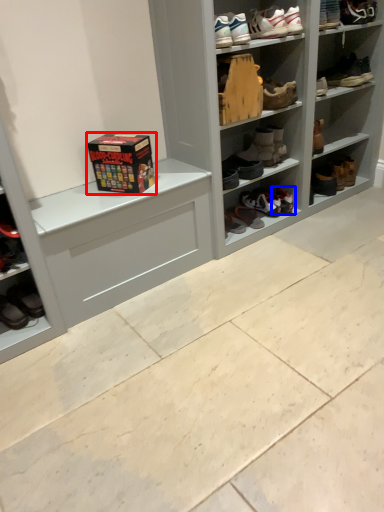
Question: Which object appears closest to the camera in this image, box (highlighted by a red box) or footwear (highlighted by a blue box)?

Choices:
 (A) box
 (B) footwear

Answer: (A)